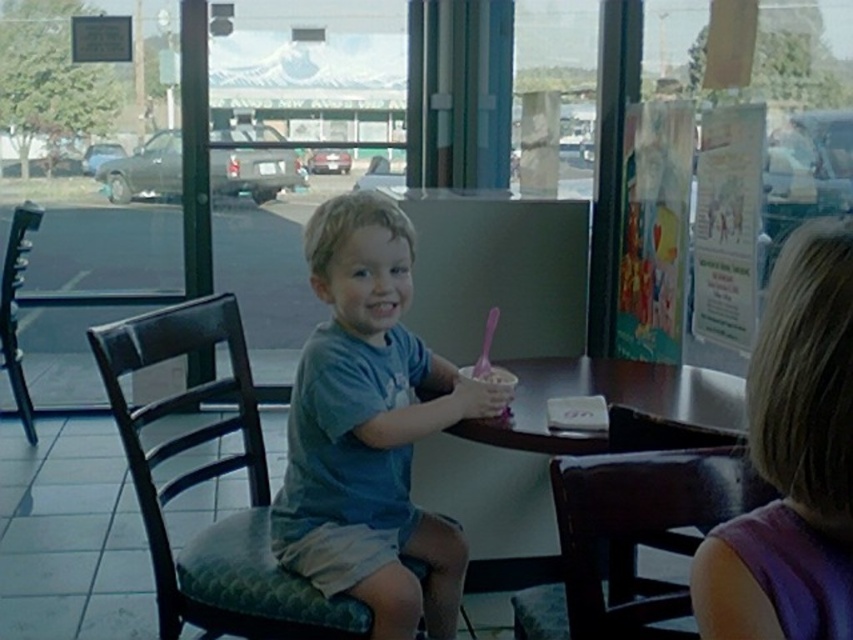
Question: Among these points, which one is nearest to the camera?

Choices:
 (A) (677, 372)
 (B) (24, 211)
 (C) (395, 525)

Answer: (C)

Question: Which point is farther to the camera?

Choices:
 (A) wooden chair at lower right
 (B) blue cotton shirt at center
 (C) black leather chair at left

Answer: (C)

Question: Is wooden chair at lower right closer to camera compared to black leather chair at left?

Choices:
 (A) yes
 (B) no

Answer: (A)

Question: Among these objects, which one is nearest to the camera?

Choices:
 (A) light brown hair at right
 (B) black leather chair at left
 (C) wooden chair at lower right
 (D) dark brown leather chair at center

Answer: (A)

Question: Does light brown hair at right appear on the left side of wooden chair at lower right?

Choices:
 (A) no
 (B) yes

Answer: (A)

Question: Does dark brown leather chair at center appear on the right side of wooden table at center?

Choices:
 (A) yes
 (B) no

Answer: (B)